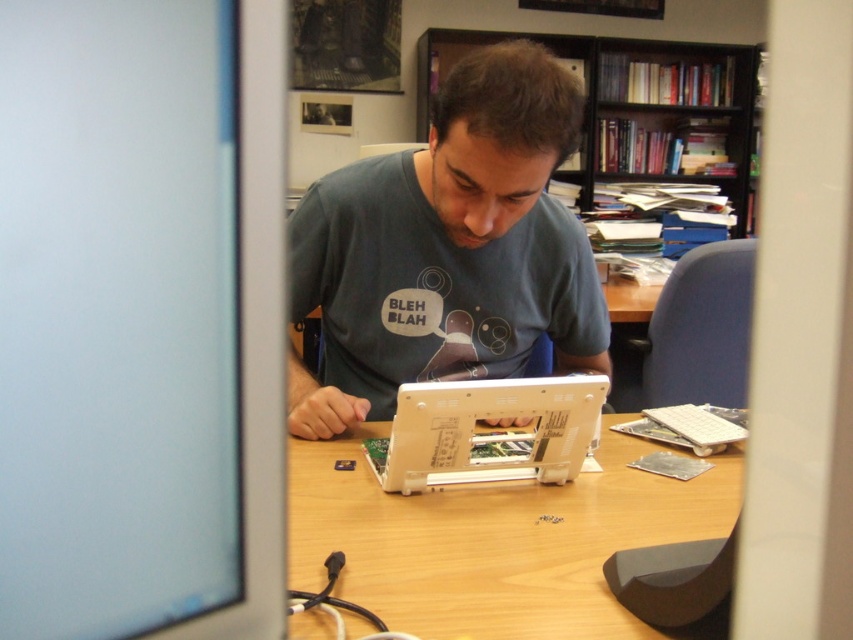
You are organizing a workspace and need to know which object takes up more desk space. Which one is larger in size between the matte black monitor at left and the wooden table at center?

The wooden table at center is larger in size than the matte black monitor at left since the monitor occupies less space than the table.

You are an office worker who needs to place a 15 cm tall paperweight on the wooden table at center. Considering the height of the white plastic laptop at center, will the paperweight be able to fit on the table without being blocked by the laptop?

The wooden table at center is not as tall as the white plastic laptop at center, meaning the laptop is taller. Since the paperweight is only 15 cm tall, it can fit on the table without being blocked by the laptop as long as there is enough space around the laptop.

You are standing at the point labeled point (660,45) in the image. You want to move to the point labeled point (100,522). Which direction should you move in relation to the person sitting at the desk?

You should move forward in relation to the person sitting at the desk because point (100,522) is in front of point (660,45).